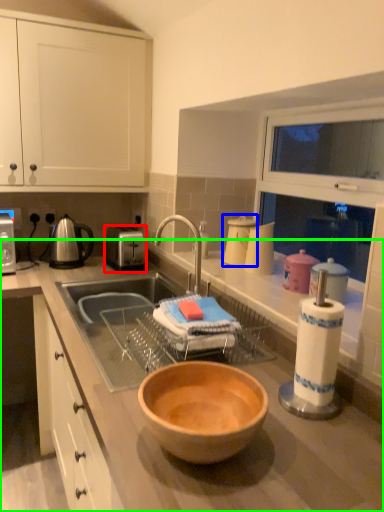
Question: Based on their relative distances, which object is farther from toaster (highlighted by a red box)? Choose from appliance (highlighted by a blue box) and countertop (highlighted by a green box).

Choices:
 (A) appliance
 (B) countertop

Answer: (A)